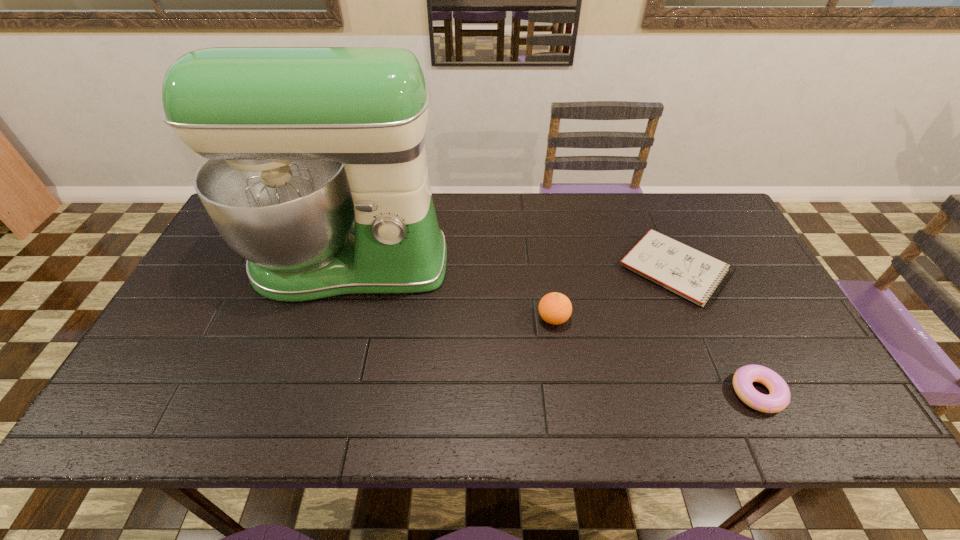
At what (x,y) coordinates should I click in order to perform the action: click on blank space that satisfies the following two spatial constraints: 1. on the back side of the third object from right to left; 2. on the right side of the shortest object. Please return your answer as a coordinate pair (x, y). Looking at the image, I should click on (546, 269).

Find the location of a particular element. This screenshot has height=540, width=960. vacant space that satisfies the following two spatial constraints: 1. on the controls of the leftmost object; 2. on the left side of the third object from right to left is located at coordinates (332, 319).

Locate an element on the screen. vacant area in the image that satisfies the following two spatial constraints: 1. on the front side of the notepad; 2. on the right side of the third tallest object is located at coordinates 729,393.